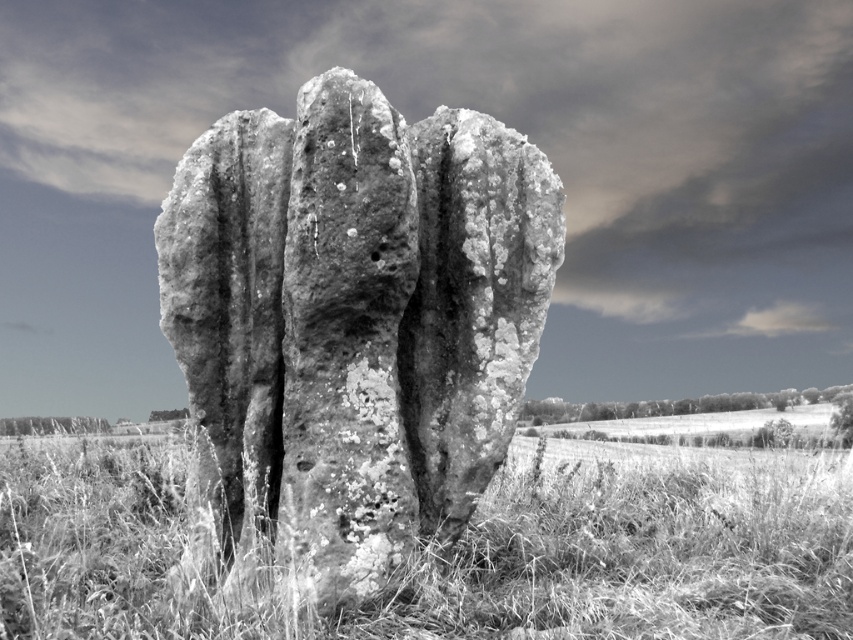
Between point (459, 241) and point (258, 634), which one is positioned behind?

The point (459, 241) is behind.

Which is above, rough stone rock at center or fuzzy grass at center?

Positioned higher is rough stone rock at center.

What do you see at coordinates (352, 324) in the screenshot? Image resolution: width=853 pixels, height=640 pixels. I see `rough stone rock at center` at bounding box center [352, 324].

At what (x,y) coordinates should I click in order to perform the action: click on rough stone rock at center. Please return your answer as a coordinate pair (x, y). Looking at the image, I should click on (352, 324).

Is point (824, 595) farther from camera compared to point (741, 413)?

No, it is in front of (741, 413).

Image resolution: width=853 pixels, height=640 pixels. What are the coordinates of `fuzzy grass at center` in the screenshot? It's located at (643, 554).

Is point (712, 630) more distant than point (810, 410)?

That is False.

Find the location of `fuzzy grass at center`. fuzzy grass at center is located at coordinates (643, 554).

Based on the photo, can you confirm if rough stone rock at center is positioned to the left of grassy field at lower center?

Correct, you'll find rough stone rock at center to the left of grassy field at lower center.

Does rough stone rock at center have a lesser width compared to grassy field at lower center?

A: Correct, rough stone rock at center's width is less than grassy field at lower center's.

Image resolution: width=853 pixels, height=640 pixels. I want to click on rough stone rock at center, so click(352, 324).